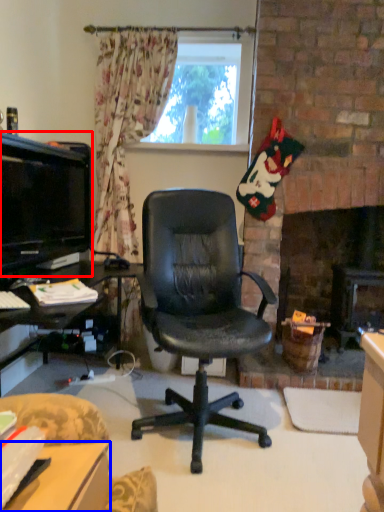
Question: Which object appears closest to the camera in this image, television (highlighted by a red box) or desk (highlighted by a blue box)?

Choices:
 (A) television
 (B) desk

Answer: (B)